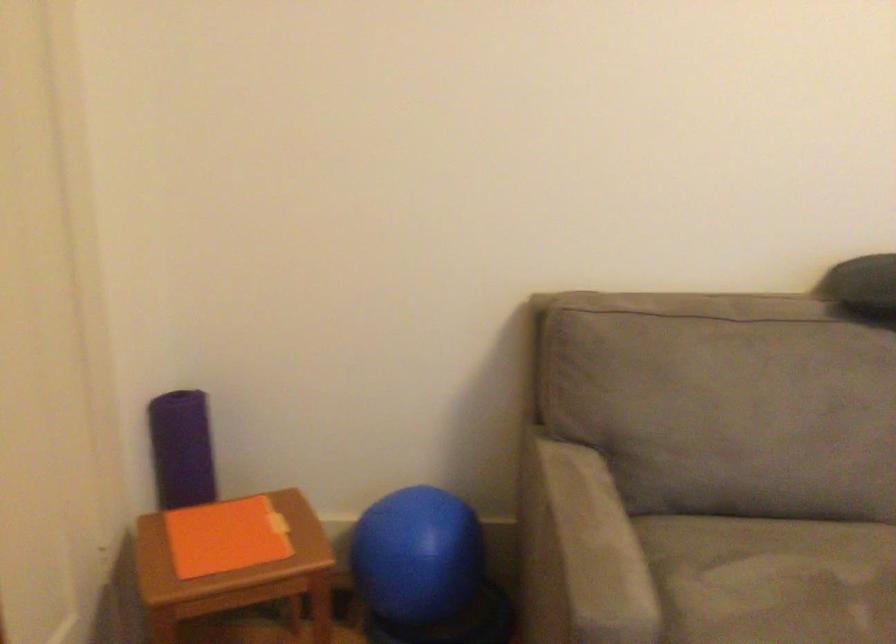
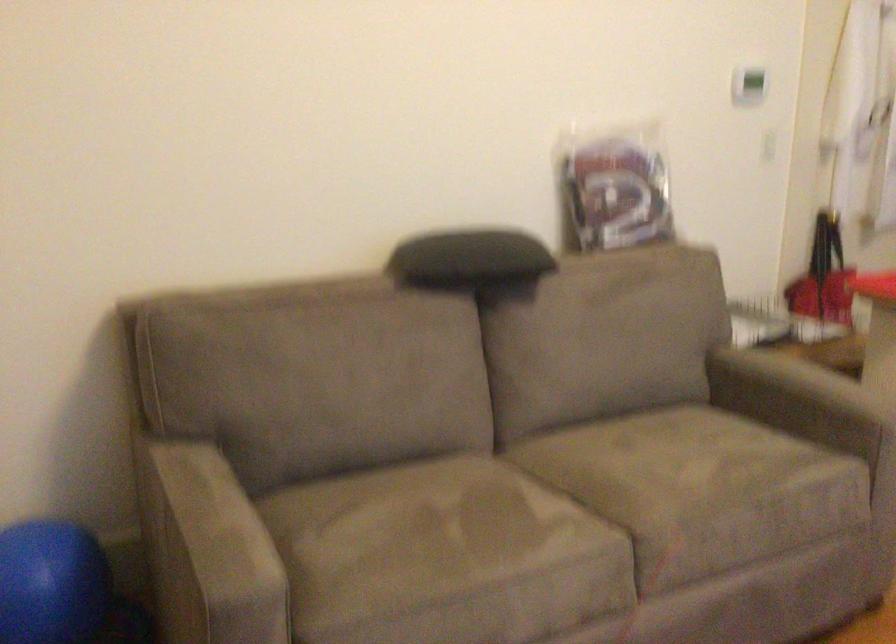
Question: The first image is from the beginning of the video and the second image is from the end. How did the camera likely rotate when shooting the video?

Choices:
 (A) Left
 (B) Right
 (C) Up
 (D) Down

Answer: (B)